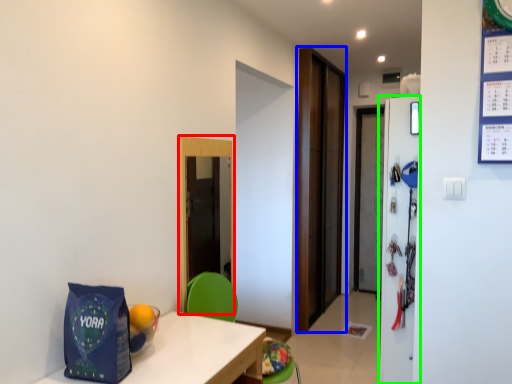
Question: Which object is the closest to the glass door (highlighted by a red box)? Choose among these: door (highlighted by a blue box) or refrigerator (highlighted by a green box).

Choices:
 (A) door
 (B) refrigerator

Answer: (B)